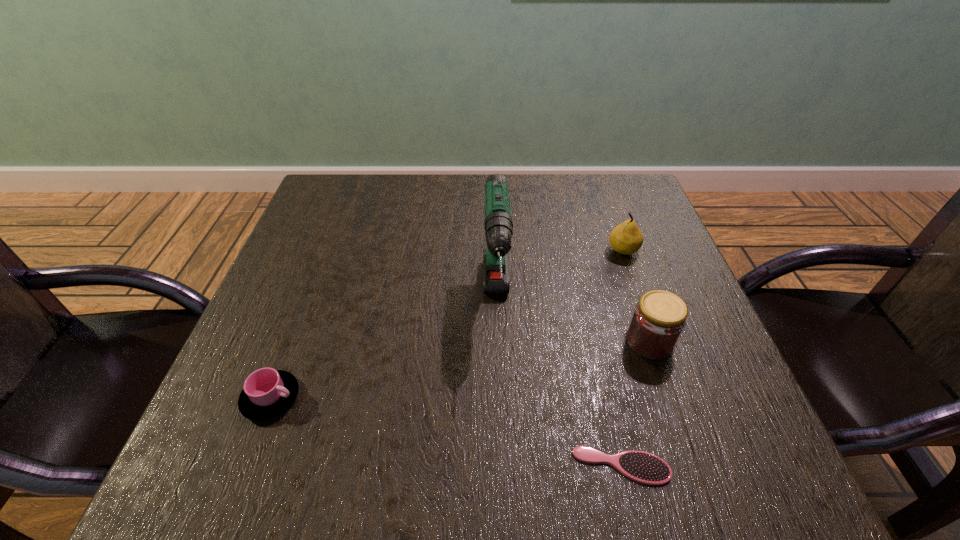
Locate an element on the screen. The image size is (960, 540). vacant area that lies between the hairbrush and the tallest object is located at coordinates click(559, 384).

Find the location of `free area in between the fourth farthest object and the pear`. free area in between the fourth farthest object and the pear is located at coordinates (447, 324).

The height and width of the screenshot is (540, 960). In order to click on free point between the leftmost object and the jam in this screenshot , I will do `click(460, 369)`.

The image size is (960, 540). I want to click on vacant space that's between the shortest object and the pear, so click(x=622, y=358).

Where is `empty location between the second shortest object and the jam`? Image resolution: width=960 pixels, height=540 pixels. empty location between the second shortest object and the jam is located at coordinates (460, 369).

At what (x,y) coordinates should I click in order to perform the action: click on vacant area between the jam and the fourth object from right to left. Please return your answer as a coordinate pair (x, y). The image size is (960, 540). Looking at the image, I should click on (573, 322).

Identify which object is the closest to the pear. Please provide its 2D coordinates. Your answer should be formatted as a tuple, i.e. [(x, y)], where the tuple contains the x and y coordinates of a point satisfying the conditions above.

[(659, 318)]

Identify the location of object identified as the second closest to the nearest object. click(x=498, y=224).

The height and width of the screenshot is (540, 960). I want to click on free spot that satisfies the following two spatial constraints: 1. on the side with the handle of the second nearest object; 2. on the right side of the hairbrush, so click(245, 466).

Locate an element on the screen. This screenshot has height=540, width=960. free space that satisfies the following two spatial constraints: 1. on the back side of the shortest object; 2. on the side with the handle of the leftmost object is located at coordinates (606, 398).